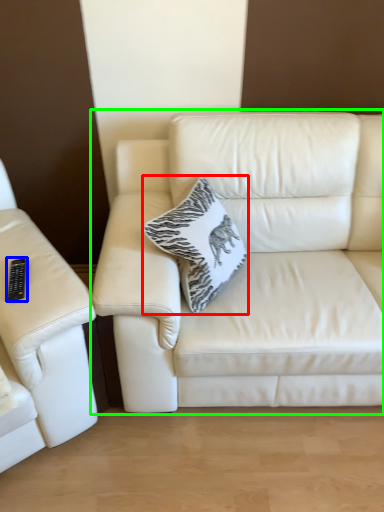
Question: Based on their relative distances, which object is farther from throw pillow (highlighted by a red box)? Choose from remote (highlighted by a blue box) and studio couch (highlighted by a green box).

Choices:
 (A) remote
 (B) studio couch

Answer: (A)